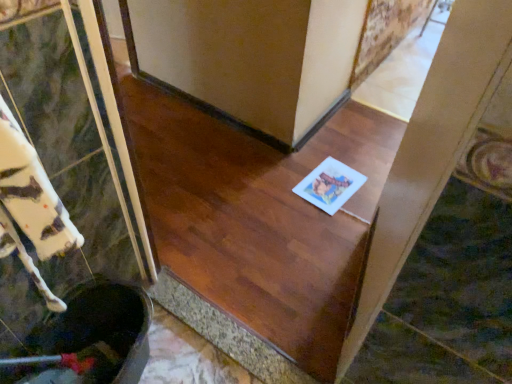
Question: From the image's perspective, is white paper at center positioned above or below white paper at center?

Choices:
 (A) above
 (B) below

Answer: (B)

Question: Is white paper at center to the left or to the right of white paper at center in the image?

Choices:
 (A) left
 (B) right

Answer: (A)

Question: Which is correct: white paper at center is inside white paper at center, or outside of it?

Choices:
 (A) outside
 (B) inside

Answer: (A)

Question: From a real-world perspective, relative to white paper at center, is white paper at center vertically above or below?

Choices:
 (A) below
 (B) above

Answer: (A)

Question: Is white paper at center to the left or to the right of white paper at center in the image?

Choices:
 (A) right
 (B) left

Answer: (A)

Question: Is point (309, 198) closer or farther from the camera than point (162, 238)?

Choices:
 (A) closer
 (B) farther

Answer: (B)

Question: From the image's perspective, is white paper at center located above or below white paper at center?

Choices:
 (A) below
 (B) above

Answer: (B)